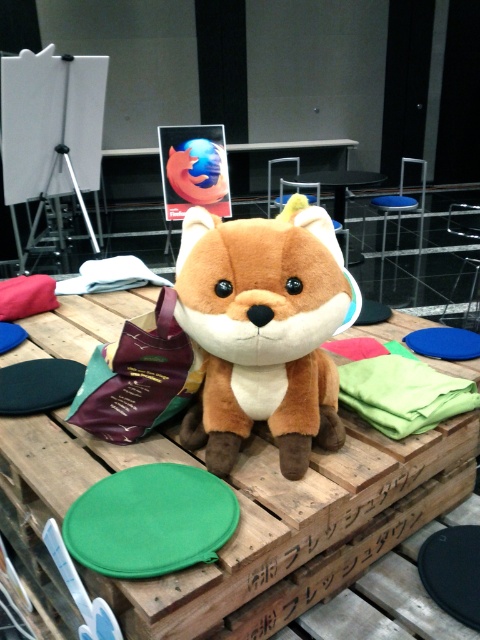
Consider the image. Can you confirm if brown wooden table at center is taller than soft fabric stuffed animal at center?

In fact, brown wooden table at center may be shorter than soft fabric stuffed animal at center.

This screenshot has height=640, width=480. What do you see at coordinates (301, 531) in the screenshot? I see `brown wooden table at center` at bounding box center [301, 531].

This screenshot has height=640, width=480. Find the location of `brown wooden table at center`. brown wooden table at center is located at coordinates (301, 531).

Can you confirm if brown wooden table at center is positioned above soft plush toy at center?

Actually, brown wooden table at center is below soft plush toy at center.

Who is more forward, (33, 550) or (238, 376)?

Point (238, 376) is more forward.

This screenshot has height=640, width=480. In order to click on brown wooden table at center in this screenshot , I will do `click(301, 531)`.

Is soft plush toy at center wider than soft fabric stuffed animal at center?

Incorrect, soft plush toy at center's width does not surpass soft fabric stuffed animal at center's.

Is point (256, 316) behind point (333, 173)?

No, it is in front of (333, 173).

Where is `soft plush toy at center`? soft plush toy at center is located at coordinates (264, 330).